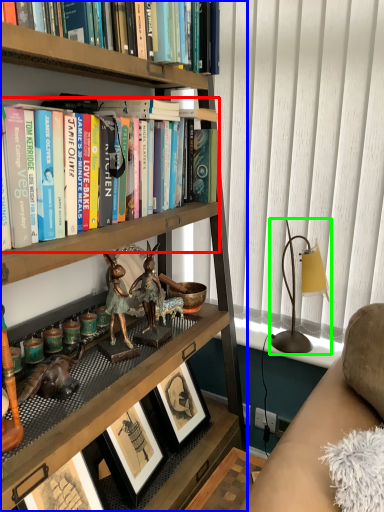
Question: Which is nearer to the book (highlighted by a red box)? bookcase (highlighted by a blue box) or table lamp (highlighted by a green box).

Choices:
 (A) bookcase
 (B) table lamp

Answer: (A)